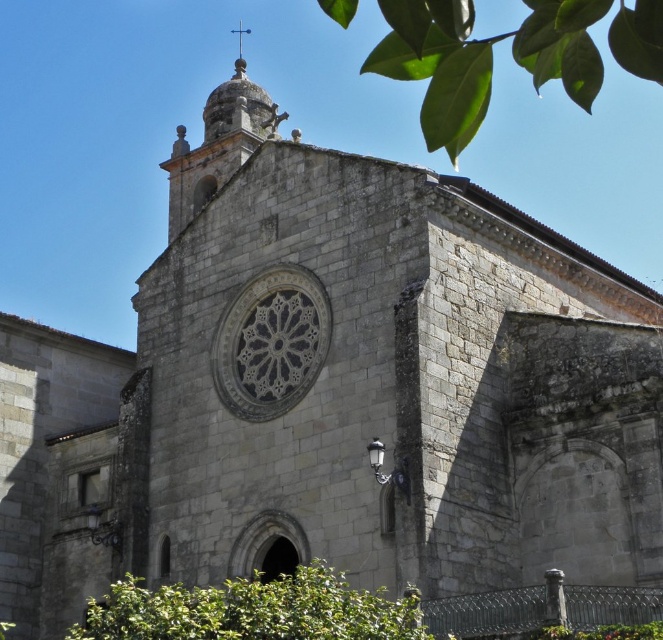
You are standing in front of the historic stone building and want to take a photo of the rose window without any obstructions. Is there a green leafy bush at lower center blocking your view? Please explain.

The green leafy bush at lower center is located at point (253, 609), which is near the lower part of the image. Since the rose window is at the center of the facade, the bush is positioned below it and would not obstruct the view of the rose window. Therefore, you can take a clear photo of the rose window without any obstruction from the green leafy bush at lower center.

You are a drone operator tasked with capturing aerial footage of the historic stone building. Your drone has a maximum flight range of 70 meters. You need to fly from the green leafy tree at upper center to the carved stone rose window at center. Can your drone safely complete this flight without exceeding its range?

The green leafy tree at upper center and the carved stone rose window at center are 71.90 meters apart from each other. Since the drone has a maximum flight range of 70 meters, it cannot safely complete the flight without exceeding its range.

You are a landscape architect designing a pathway that needs to pass between the green leafy bush at lower center and the carved stone rose window at center. The pathway must be at least 2 meters wide. Can the space between them accommodate this width?

The green leafy bush at lower center is wider than the carved stone rose window at center. However, the description does not provide specific measurements of their widths or the distance between them. Without knowing the exact dimensions, it is impossible to determine if the 2 meter pathway requirement can be met.